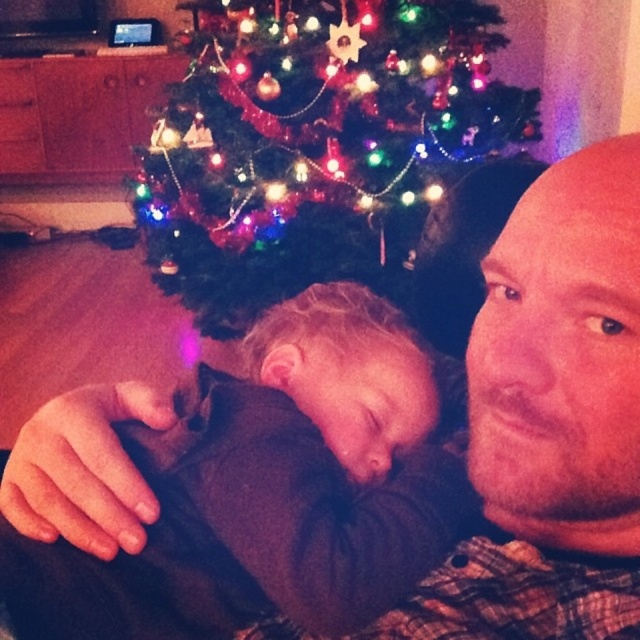
Does soft brown sweater at center come behind green matte christmas tree at upper center?

That is False.

Can you confirm if soft brown sweater at center is smaller than green matte christmas tree at upper center?

Correct, soft brown sweater at center occupies less space than green matte christmas tree at upper center.

Who is more distant from viewer, [276,353] or [170,96]?

The point [170,96] is behind.

This screenshot has width=640, height=640. I want to click on soft brown sweater at center, so click(269, 490).